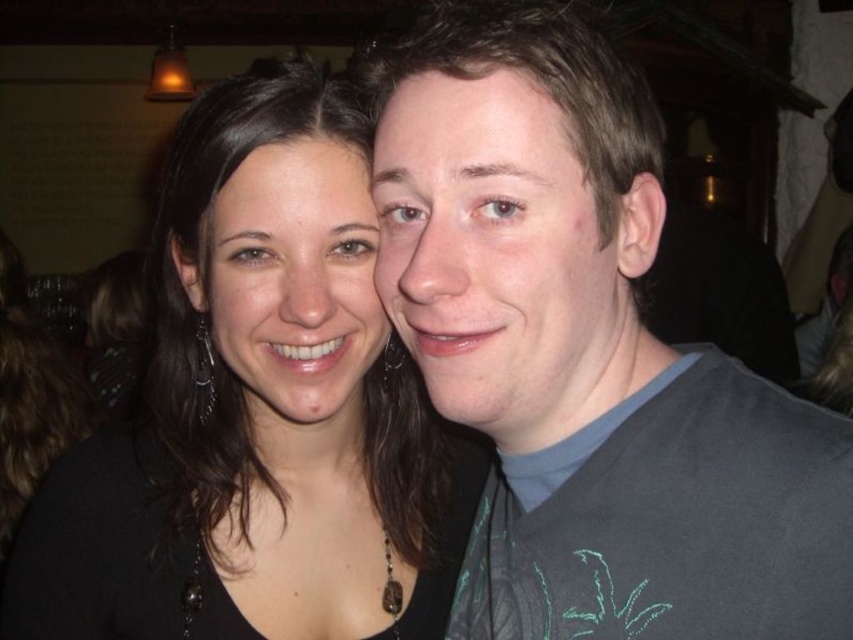
You are a photographer adjusting the lighting for a portrait. You notice the gray fabric shirt at center and the black matte hair at center. Which object should you focus on first to ensure proper exposure, considering their position?

The gray fabric shirt at center is in front of the black matte hair at center, so you should focus on the gray fabric shirt at center first to ensure proper exposure.

You are standing in front of the photograph and want to touch the point that is closer to you. Which point should you choose between point (421, 246) and point (39, 552)?

Point (421, 246) is closer to the viewer than point (39, 552), so you should choose point (421, 246).

In the image, there is a man and a woman posing together. The man is wearing a dark shirt with a green leaf design on the left side, and the woman is wearing a black top with a necklace. There is also a point marked at coordinates (587, 355). What object is located at that point?

The point at coordinates (587, 355) indicates the gray fabric shirt at center.